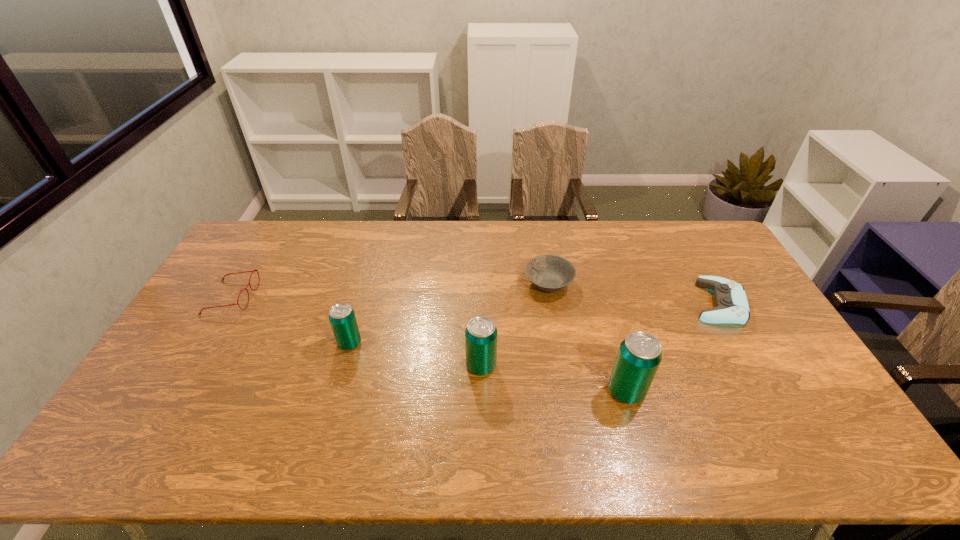
In the image, there is a desktop. At what (x,y) coordinates should I click in order to perform the action: click on blank space at the right edge. Please return your answer as a coordinate pair (x, y). The width and height of the screenshot is (960, 540). Looking at the image, I should click on (772, 355).

You are a GUI agent. You are given a task and a screenshot of the screen. Output one action in this format:
    pyautogui.click(x=<x>, y=<y>)
    Task: Click on the free space at the far right corner
    The height and width of the screenshot is (540, 960).
    Given the screenshot: What is the action you would take?
    pyautogui.click(x=706, y=252)

This screenshot has width=960, height=540. I want to click on free spot between the third object from right to left and the rightmost beer can, so click(588, 338).

Where is `free space between the fifth object from left to right and the fourth object from left to right`? The width and height of the screenshot is (960, 540). free space between the fifth object from left to right and the fourth object from left to right is located at coordinates (588, 338).

The height and width of the screenshot is (540, 960). Identify the location of blank region between the spectacles and the third nearest object. (291, 320).

Locate an element on the screen. This screenshot has width=960, height=540. vacant area that lies between the second tallest object and the bowl is located at coordinates (515, 325).

The image size is (960, 540). Identify the location of free spot between the fourth object from left to right and the fifth shortest object. (515, 325).

The image size is (960, 540). I want to click on free space that is in between the bowl and the second object from right to left, so click(588, 338).

Find the location of a particular element. empty space that is in between the spectacles and the rightmost beer can is located at coordinates (429, 344).

Find the location of a particular element. This screenshot has width=960, height=540. empty space that is in between the bowl and the rightmost beer can is located at coordinates (588, 338).